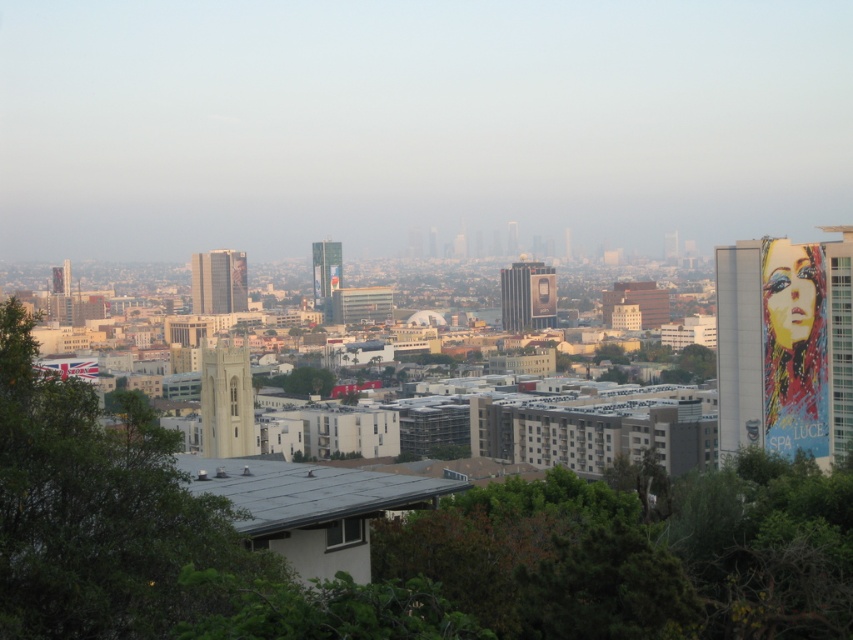
The image size is (853, 640). What do you see at coordinates (97, 512) in the screenshot? I see `green leafy tree at left` at bounding box center [97, 512].

Where is `green leafy tree at left`? green leafy tree at left is located at coordinates (97, 512).

Based on the photo, who is higher up, green leafy tree at left or painted mural at right?

painted mural at right is above.

What do you see at coordinates (97, 512) in the screenshot?
I see `green leafy tree at left` at bounding box center [97, 512].

Locate an element on the screen. green leafy tree at left is located at coordinates (97, 512).

Is painted mural at right shorter than light beige stone tower at center?

Incorrect, painted mural at right's height does not fall short of light beige stone tower at center's.

Does point (775, 348) come farther from viewer compared to point (241, 416)?

Yes, point (775, 348) is behind point (241, 416).

Who is more distant from viewer, (747, 404) or (247, 381)?

The point (747, 404) is behind.

Where is `painted mural at right`? Image resolution: width=853 pixels, height=640 pixels. painted mural at right is located at coordinates (785, 346).